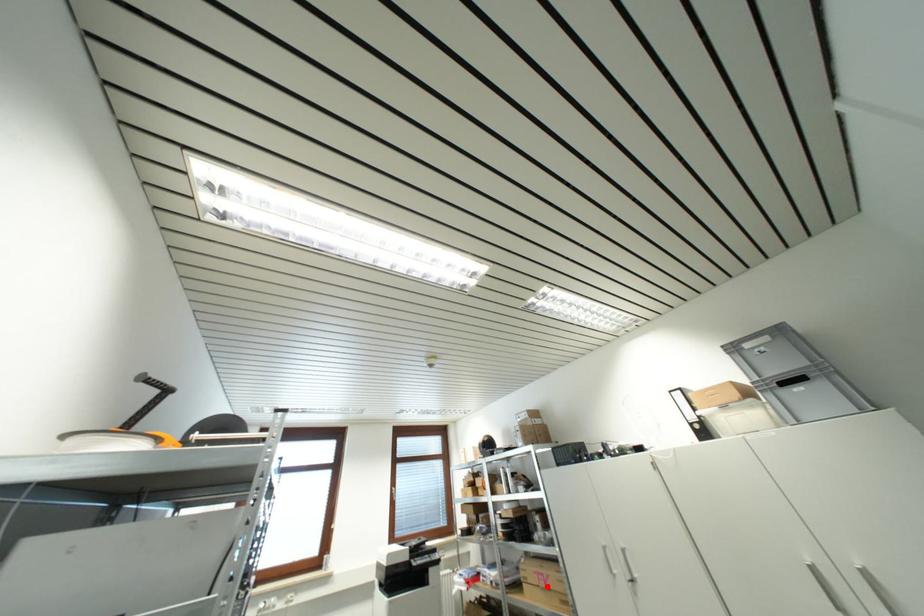
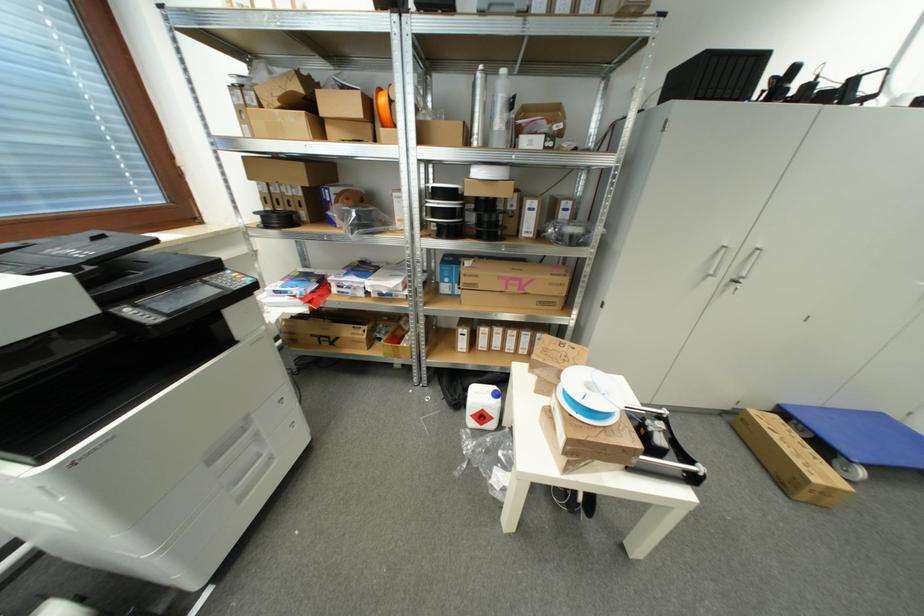
Question: I am providing you with two images of the same scene from different viewpoints. Image1 has a red point marked. In image2, the corresponding 3D location appears at what relative position? Reply with the corresponding letter.

Choices:
 (A) Closer
 (B) Farther

Answer: (A)